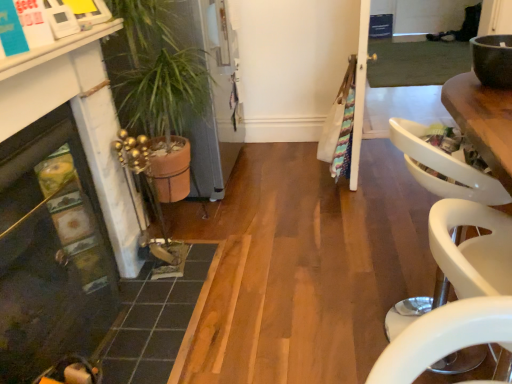
Question: Relative to terracotta pot at left, is matte brown bowl at upper right in front or behind?

Choices:
 (A) front
 (B) behind

Answer: (A)

Question: From a real-world perspective, is matte brown bowl at upper right physically located above or below terracotta pot at left?

Choices:
 (A) below
 (B) above

Answer: (B)

Question: Based on their relative distances, which object is farther from the matte brown bowl at upper right?

Choices:
 (A) terracotta pot at left
 (B) dark gray tile at lower left
 (C) white plastic armchair at right
 (D) white glossy counter top at upper left
 (E) matte black fireplace at lower left

Answer: (E)

Question: Based on their relative distances, which object is farther from the terracotta pot at left?

Choices:
 (A) matte black fireplace at lower left
 (B) white glossy counter top at upper left
 (C) matte brown bowl at upper right
 (D) white plastic armchair at right
 (E) dark gray tile at lower left

Answer: (C)